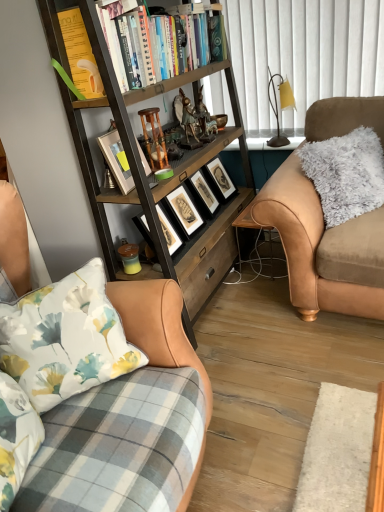
Question: Considering their positions, is fuzzy beige couch at right, the first studio couch from the back, located in front of or behind white textured curtain at upper center?

Choices:
 (A) front
 (B) behind

Answer: (A)

Question: Is point (319, 301) closer or farther from the camera than point (347, 44)?

Choices:
 (A) closer
 (B) farther

Answer: (A)

Question: Which of these objects is positioned closest to the wooden bookcase at left?

Choices:
 (A) hardcover books at upper center
 (B) yellow matte candle at lower center
 (C) fuzzy beige couch at right, the first studio couch positioned from the right
 (D) wooden picture frame at upper center, positioned as the 2th picture frame in right-to-left order
 (E) white textured curtain at upper center

Answer: (A)

Question: Considering the real-world distances, which object is closest to the wooden picture frame at upper center, positioned as the 1th picture frame in left-to-right order?

Choices:
 (A) wooden bookcase at left
 (B) black matte picture frame at center, marked as the second picture frame in a front-to-back arrangement
 (C) fuzzy beige couch at right, marked as the second studio couch in a left-to-right arrangement
 (D) hardcover books at upper center
 (E) white textured curtain at upper center

Answer: (A)